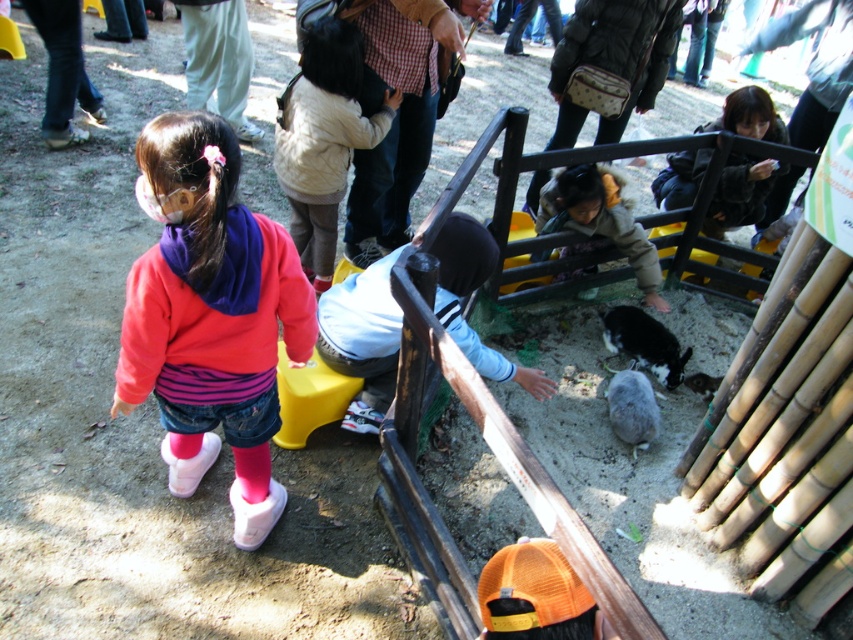
Question: Does white fuzzy jacket at center have a larger size compared to fluffy gray rabbit at center?

Choices:
 (A) no
 (B) yes

Answer: (B)

Question: Which of the following is the closest to the observer?

Choices:
 (A) matte black jacket at upper right
 (B) pink fleece jacket at left

Answer: (B)

Question: Which point is farther to the camera?

Choices:
 (A) (708, 392)
 (B) (314, 275)

Answer: (B)

Question: Is pink fleece jacket at left bigger than black and white fur rabbit at center?

Choices:
 (A) no
 (B) yes

Answer: (B)

Question: Which object is positioned closest to the light brown plush jacket at center?

Choices:
 (A) black and white fur rabbit at center
 (B) pink fleece jacket at left
 (C) white fuzzy jacket at center

Answer: (A)

Question: Is black and white fur rabbit at center positioned behind gray furry rabbit at center?

Choices:
 (A) no
 (B) yes

Answer: (B)